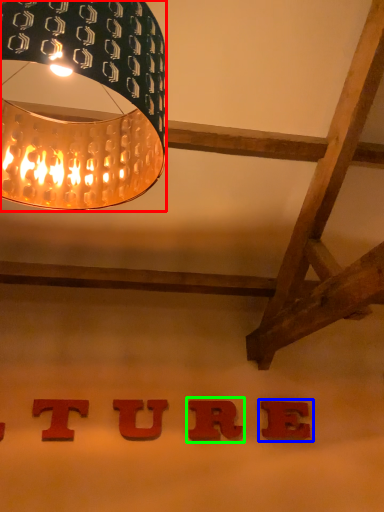
Question: Which object is positioned closest to lamp (highlighted by a red box)? Select from alphabet (highlighted by a blue box) and alphabet (highlighted by a green box).

Choices:
 (A) alphabet
 (B) alphabet

Answer: (B)